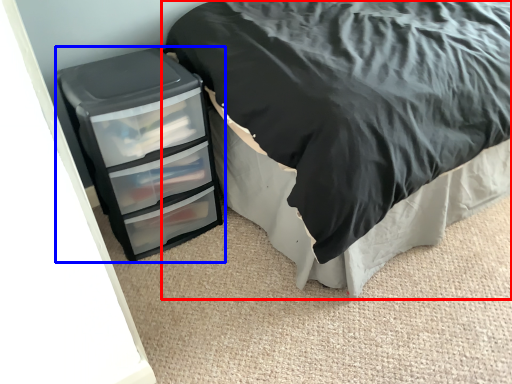
Question: Among these objects, which one is farthest to the camera, bed (highlighted by a red box) or chest of drawers (highlighted by a blue box)?

Choices:
 (A) bed
 (B) chest of drawers

Answer: (B)